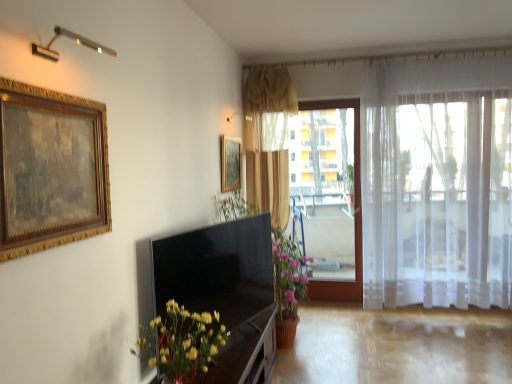
Question: Visually, is yellow matte vase at lower left positioned to the left or to the right of gold wood picture frame at upper left, marked as the second picture frame in a right-to-left arrangement?

Choices:
 (A) right
 (B) left

Answer: (A)

Question: Considering their positions, is yellow matte vase at lower left located in front of or behind gold wood picture frame at upper left, the first picture frame from the front?

Choices:
 (A) behind
 (B) front

Answer: (A)

Question: Which is nearer to the satin black tv at center?

Choices:
 (A) gold-framed picture at center, acting as the second picture frame starting from the front
 (B) wooden dresser at lower center
 (C) white sheer curtain at right, placed as the 2th curtain when sorted from left to right
 (D) yellow matte vase at lower left
 (E) matte gold curtain at center, which ranks as the 2th curtain in right-to-left order

Answer: (B)

Question: Which of these objects is positioned farthest from the yellow matte vase at lower left?

Choices:
 (A) satin black tv at center
 (B) gold-framed picture at center, arranged as the 1th picture frame when viewed from the back
 (C) gold wood picture frame at upper left, marked as the second picture frame in a right-to-left arrangement
 (D) transparent plastic window screen at center
 (E) wooden dresser at lower center

Answer: (D)